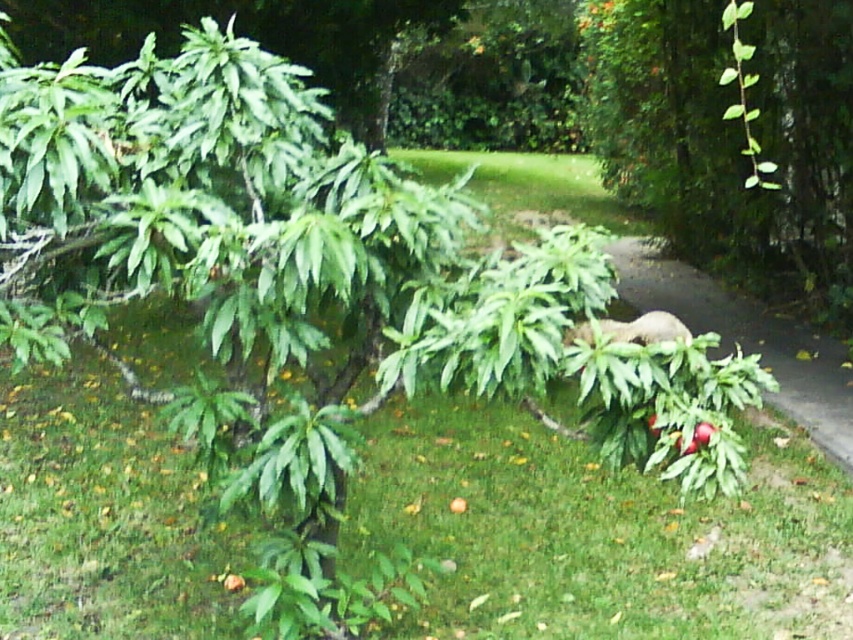
You are a photographer trying to capture both the fuzzy brown bear at center and the red matte apple at lower right in a single shot. Based on their positions and sizes, can you fit both subjects into your camera frame without moving either the bear or the apple?

The fuzzy brown bear at center might be wider than red matte apple at lower right, so it depends on the camera frame size. If the camera can accommodate the width of the bear, then both subjects can be included.

From the picture: You are standing in the garden and see the green leafy plant at center and the fuzzy brown bear at center. Which object is positioned higher in the image?

The green leafy plant at center is above the fuzzy brown bear at center, so the green leafy plant at center is positioned higher in the image.